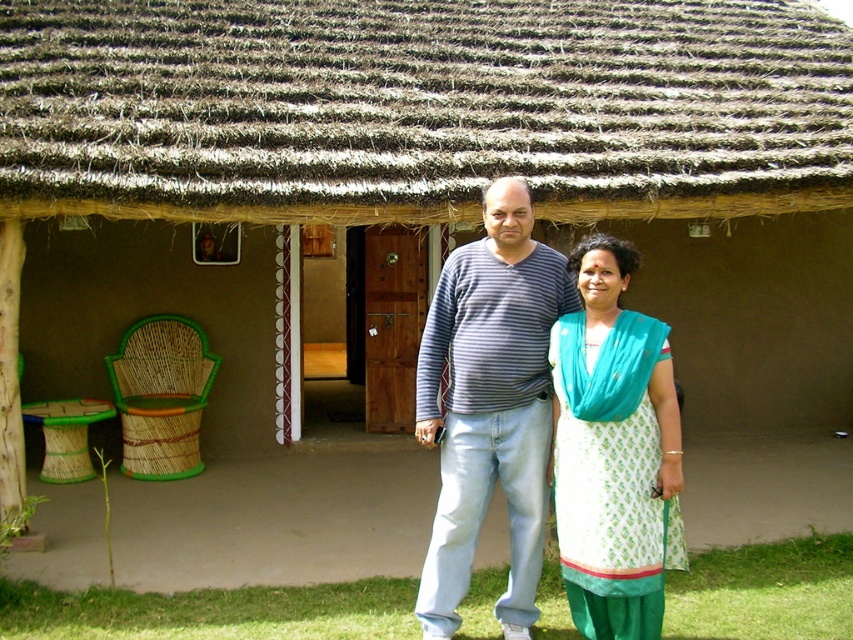
Is striped cotton shirt at center thinner than white printed cotton dress at center?

No.

Who is lower down, striped cotton shirt at center or white printed cotton dress at center?

white printed cotton dress at center

Is point (451, 532) farther from viewer compared to point (616, 472)?

That is True.

At what (x,y) coordinates should I click in order to perform the action: click on striped cotton shirt at center. Please return your answer as a coordinate pair (x, y). The height and width of the screenshot is (640, 853). Looking at the image, I should click on (490, 404).

Is point (109, 61) positioned after point (537, 557)?

That is True.

Who is shorter, brown thatch at upper center or striped cotton shirt at center?

brown thatch at upper center

Identify the location of brown thatch at upper center. This screenshot has width=853, height=640. (421, 108).

Who is more forward, (26, 29) or (614, 400)?

Point (614, 400)

Who is positioned more to the right, brown thatch at upper center or white printed cotton dress at center?

From the viewer's perspective, white printed cotton dress at center appears more on the right side.

Image resolution: width=853 pixels, height=640 pixels. What do you see at coordinates (421, 108) in the screenshot?
I see `brown thatch at upper center` at bounding box center [421, 108].

This screenshot has height=640, width=853. Identify the location of brown thatch at upper center. (421, 108).